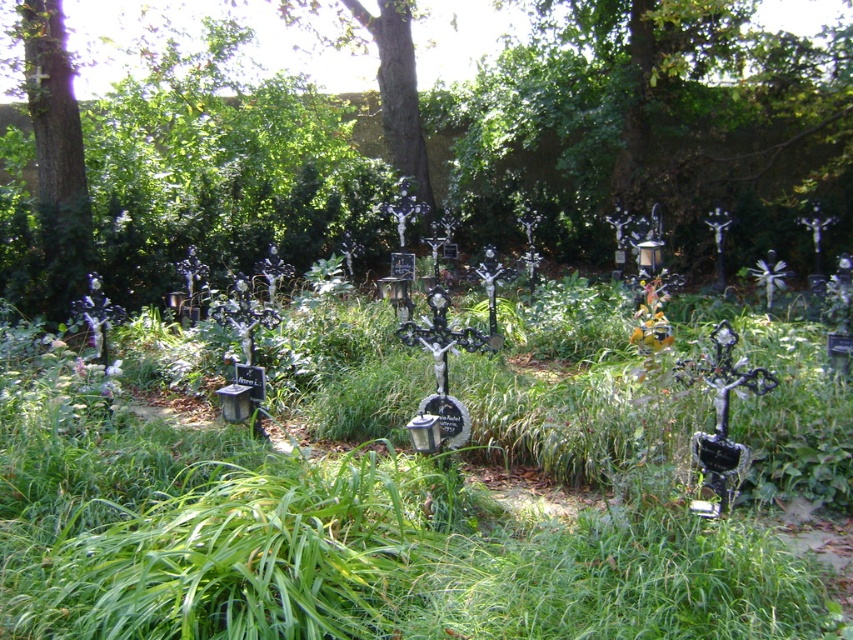
Is green leafy tree at center in front of smooth bark tree at left?

Yes, it is in front of smooth bark tree at left.

Image resolution: width=853 pixels, height=640 pixels. Describe the element at coordinates (451, 145) in the screenshot. I see `green leafy tree at center` at that location.

The image size is (853, 640). I want to click on green leafy tree at center, so click(x=451, y=145).